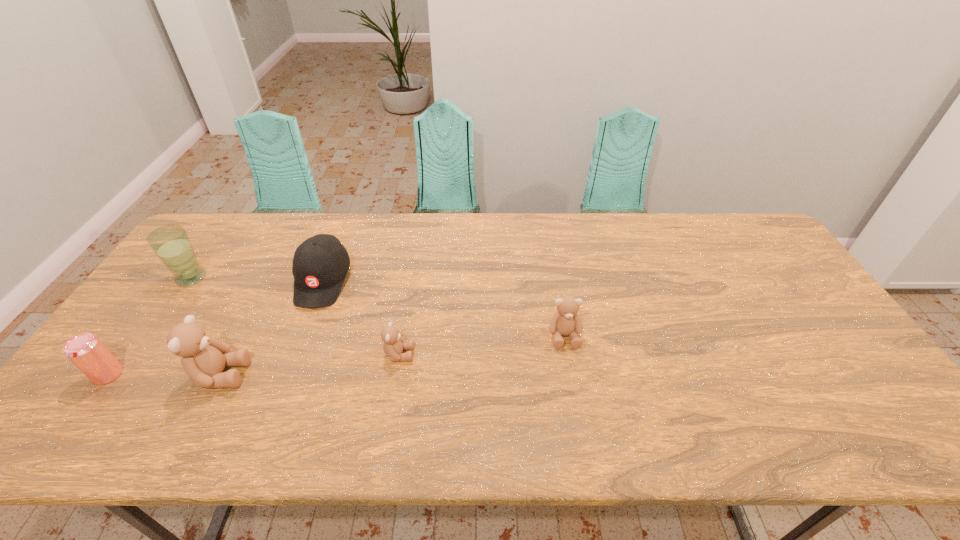
Where is `vacant area that satisfies the following two spatial constraints: 1. on the back side of the glass; 2. on the left side of the beer can`? Image resolution: width=960 pixels, height=540 pixels. vacant area that satisfies the following two spatial constraints: 1. on the back side of the glass; 2. on the left side of the beer can is located at coordinates (179, 278).

Identify the location of free location that satisfies the following two spatial constraints: 1. on the front-facing side of the second tallest teddy bear; 2. on the front-facing side of the tallest teddy bear. (571, 375).